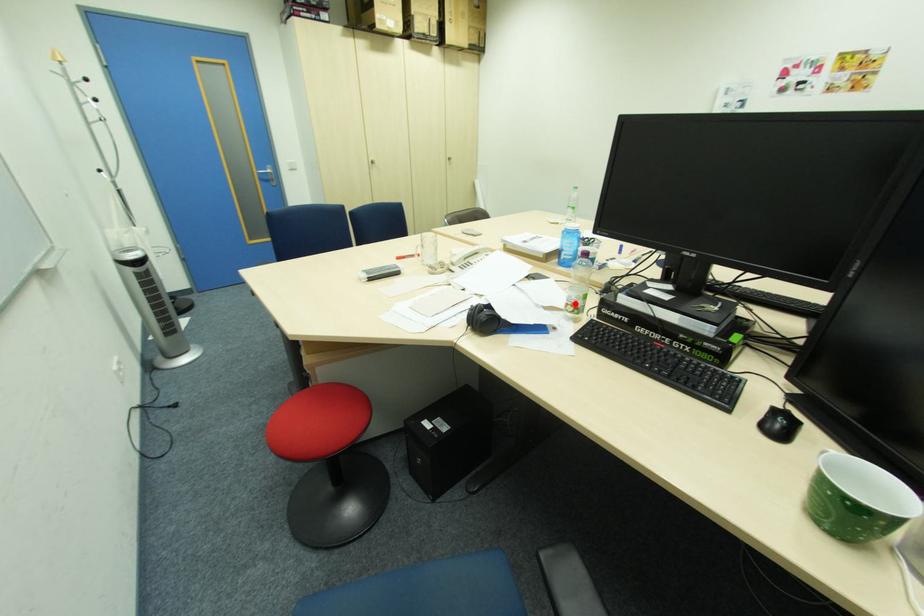
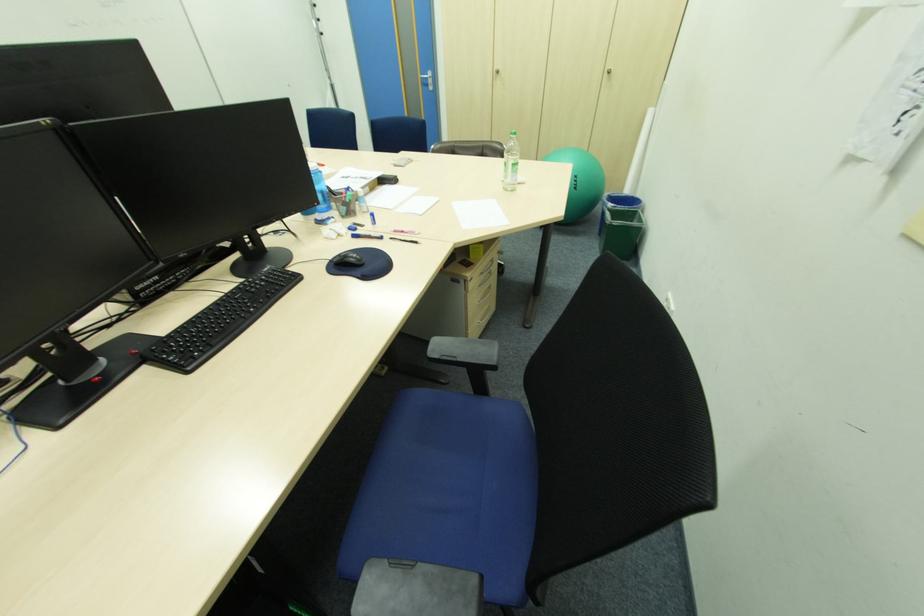
Question: I am providing you with two images of the same scene from different viewpoints. A red point is marked on the first image. At the location where the point appears in image 1, is it still visible in image 2?

Choices:
 (A) Yes
 (B) No

Answer: (B)